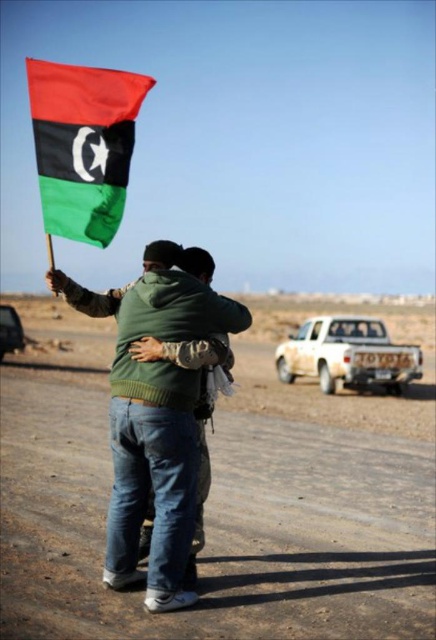
Is point (65, 157) less distant than point (6, 316)?

Yes, it is.

Can you confirm if matte black flag at upper left is taller than metallic silver car at lower left?

Yes.

What do you see at coordinates (82, 145) in the screenshot? Image resolution: width=436 pixels, height=640 pixels. I see `matte black flag at upper left` at bounding box center [82, 145].

At what (x,y) coordinates should I click in order to perform the action: click on matte black flag at upper left. Please return your answer as a coordinate pair (x, y). Image resolution: width=436 pixels, height=640 pixels. Looking at the image, I should click on (82, 145).

Which is more to the right, green matte hoodie at center or metallic silver car at lower left?

green matte hoodie at center is more to the right.

Is point (143, 292) in front of point (10, 330)?

That is True.

Find the location of a particular element. This screenshot has height=640, width=436. green matte hoodie at center is located at coordinates (156, 412).

Who is positioned more to the right, green matte hoodie at center or white matte truck at center?

Positioned to the right is white matte truck at center.

Who is more forward, (129,483) or (357,316)?

Point (129,483) is in front.

I want to click on green matte hoodie at center, so click(156, 412).